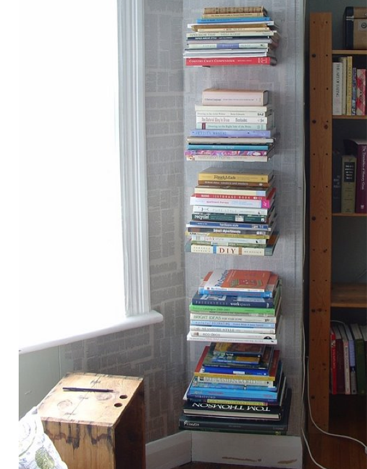
Where is `grey brick wall design`? The image size is (367, 469). grey brick wall design is located at coordinates (156, 366).